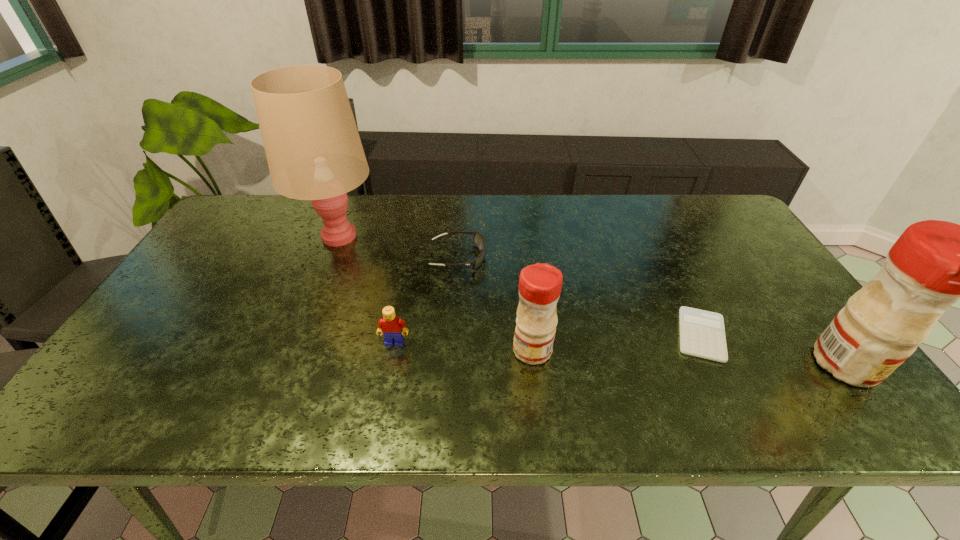
The height and width of the screenshot is (540, 960). I want to click on calculator, so click(702, 334).

Where is `the fifth object from left to right`? the fifth object from left to right is located at coordinates (702, 334).

Find the location of `vacant region located 0.380m on the left of the fourth object from left to right`. vacant region located 0.380m on the left of the fourth object from left to right is located at coordinates (353, 350).

Find the location of a particular element. The width and height of the screenshot is (960, 540). vacant region located on the back of the rightmost object is located at coordinates (783, 281).

You are a GUI agent. You are given a task and a screenshot of the screen. Output one action in this format:
    pyautogui.click(x=<x>, y=<y>)
    Task: Click on the vacant space located on the lenses of the fourth object from right to left
    The height and width of the screenshot is (540, 960).
    Given the screenshot: What is the action you would take?
    pyautogui.click(x=614, y=258)

Identify the location of vacant space situated on the front of the tallest object. The image size is (960, 540). (318, 288).

Image resolution: width=960 pixels, height=540 pixels. Identify the location of free space located 0.100m on the face of the Lego. [387, 382].

Find the location of a particular element. vacant space located 0.100m on the left of the calculator is located at coordinates [x=632, y=335].

Where is `object present at the far edge`? object present at the far edge is located at coordinates (314, 152).

Where is `calculator present at the near edge`? The width and height of the screenshot is (960, 540). calculator present at the near edge is located at coordinates (702, 334).